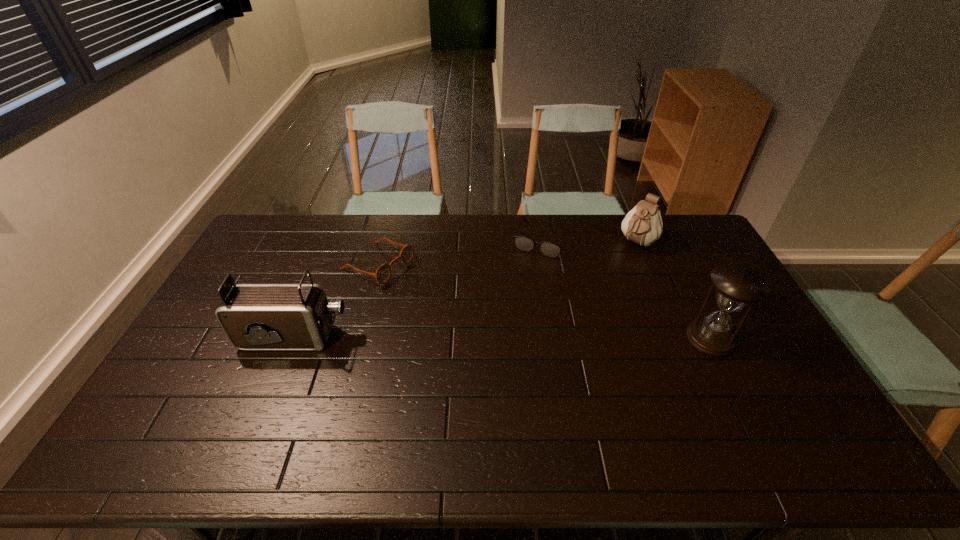
Identify the location of camcorder. (253, 316).

I want to click on hourglass, so click(x=736, y=286).

This screenshot has width=960, height=540. I want to click on the third object from right to left, so click(526, 244).

Identify the location of pouch. The image size is (960, 540). (643, 225).

The image size is (960, 540). I want to click on the left spectacles, so click(x=383, y=273).

Locate an element on the screen. This screenshot has height=540, width=960. free space located 0.340m at the lens of the camcorder is located at coordinates (462, 338).

Find the location of a particular element. The width and height of the screenshot is (960, 540). vacant area situated 0.190m on the front of the hourglass is located at coordinates (750, 417).

This screenshot has height=540, width=960. I want to click on vacant region located on the front-facing side of the third object from right to left, so [x=520, y=288].

You are a GUI agent. You are given a task and a screenshot of the screen. Output one action in this format:
    pyautogui.click(x=<x>, y=<y>)
    Task: Click on the vacant space situated 0.340m on the front-facing side of the third object from right to left
    The width and height of the screenshot is (960, 540).
    Given the screenshot: What is the action you would take?
    pyautogui.click(x=503, y=326)

Identify the location of free region located on the front-facing side of the third object from right to left. This screenshot has width=960, height=540. point(515,302).